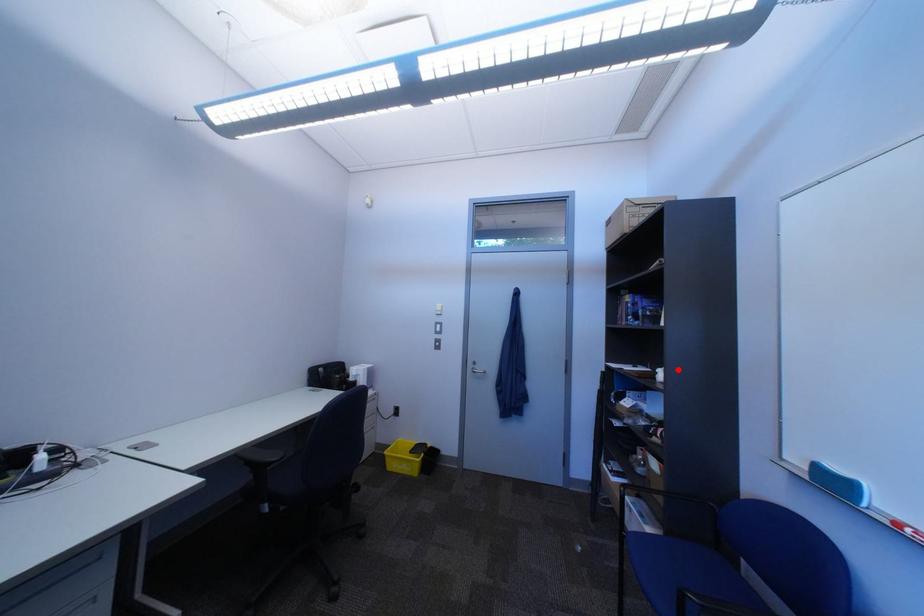
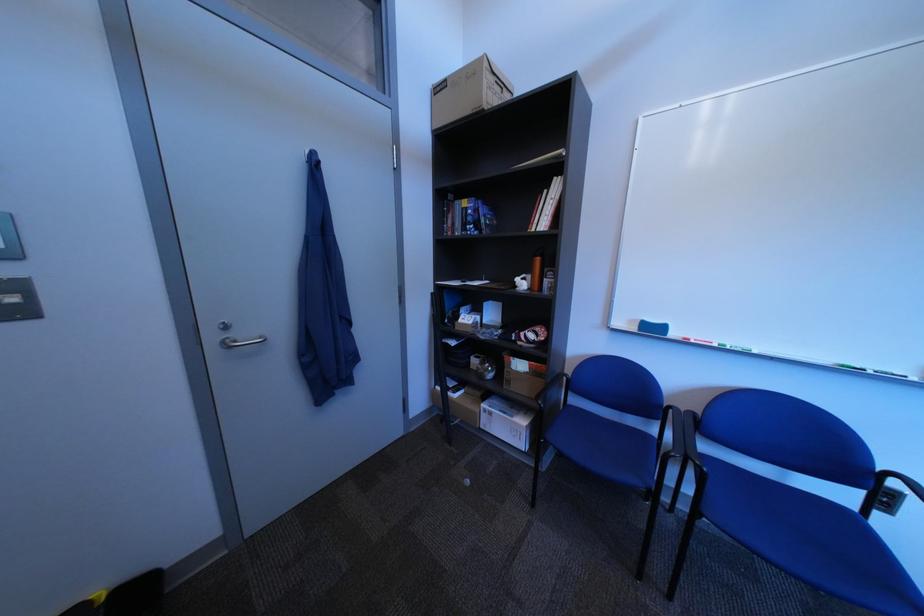
Locate, in the second image, the point that corresponds to the highlighted location in the first image.

(535, 278)